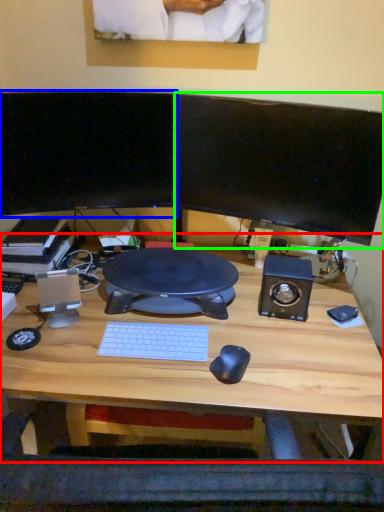
Question: Which object is positioned farthest from desk (highlighted by a red box)? Select from computer monitor (highlighted by a blue box) and computer monitor (highlighted by a green box).

Choices:
 (A) computer monitor
 (B) computer monitor

Answer: (A)